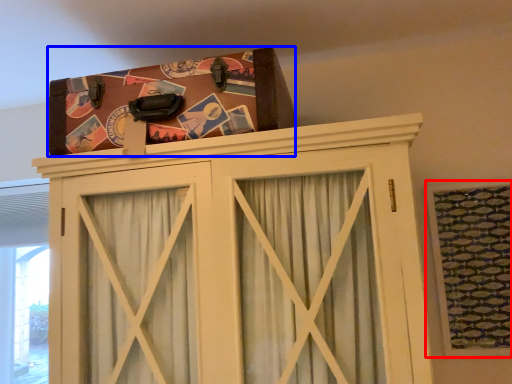
Question: Which of the following is the closest to the observer, window (highlighted by a red box) or package (highlighted by a blue box)?

Choices:
 (A) window
 (B) package

Answer: (B)